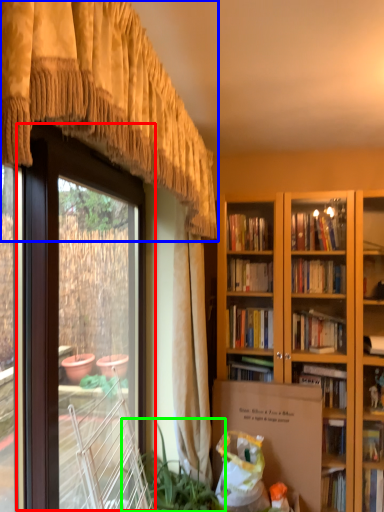
Question: Which is farther away from screen door (highlighted by a red box)? curtain (highlighted by a blue box) or houseplant (highlighted by a green box)?

Choices:
 (A) curtain
 (B) houseplant

Answer: (B)